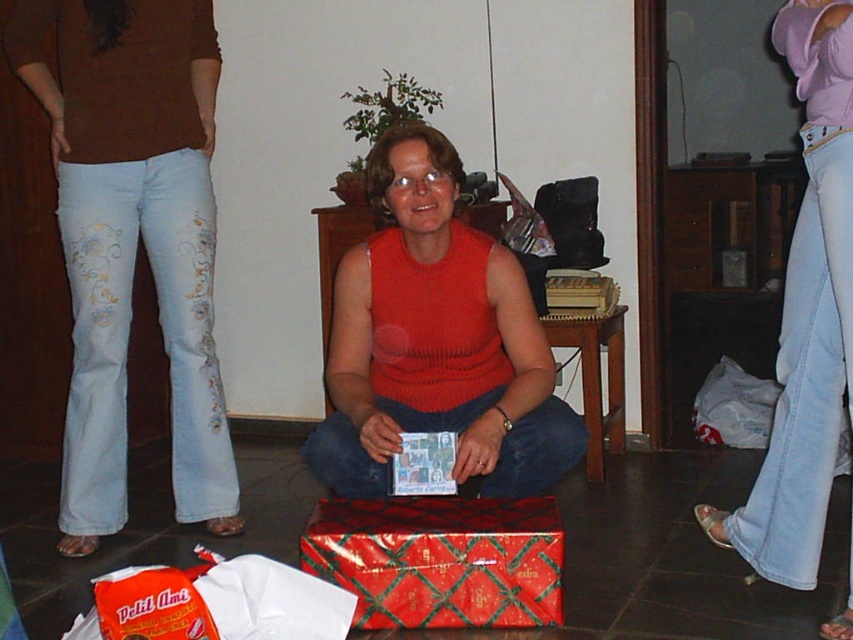
Question: Does red knitted tank top at center appear on the right side of light purple fabric at upper right?

Choices:
 (A) yes
 (B) no

Answer: (B)

Question: Which object is positioned farthest from the shiny red wrapping paper at center?

Choices:
 (A) wooden stool at center
 (B) red knitted tank top at center
 (C) light blue denim jeans at left
 (D) light purple fabric at upper right

Answer: (A)

Question: Which of the following is the farthest from the observer?

Choices:
 (A) (569, 456)
 (B) (105, 516)
 (C) (331, 536)
 (D) (833, 358)

Answer: (B)

Question: Which object is positioned farthest from the light blue denim jeans at left?

Choices:
 (A) red knitted tank top at center
 (B) light purple fabric at upper right

Answer: (B)

Question: Can you confirm if red knitted tank top at center is wider than shiny red wrapping paper at center?

Choices:
 (A) no
 (B) yes

Answer: (B)

Question: Can you confirm if red knitted tank top at center is positioned to the right of shiny red wrapping paper at center?

Choices:
 (A) no
 (B) yes

Answer: (A)